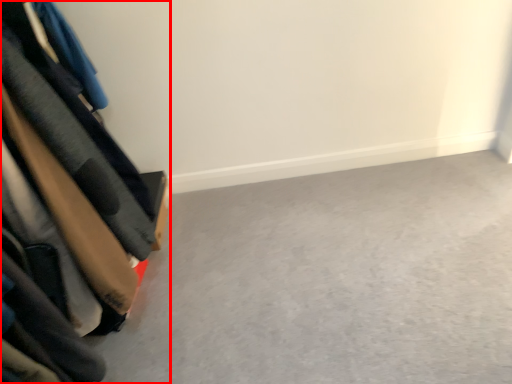
Question: Where is furniture (annotated by the red box) located in relation to concrete in the image?

Choices:
 (A) right
 (B) left

Answer: (B)